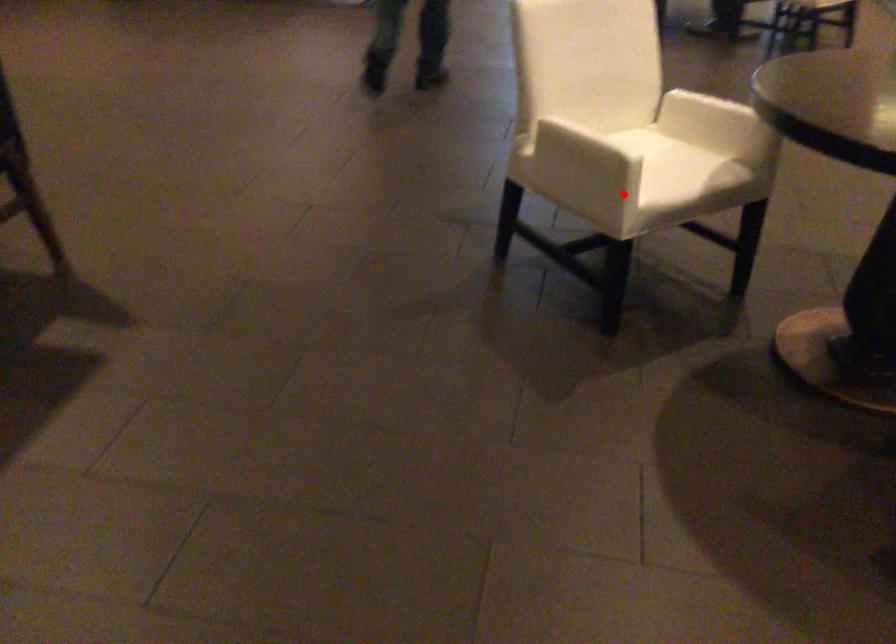
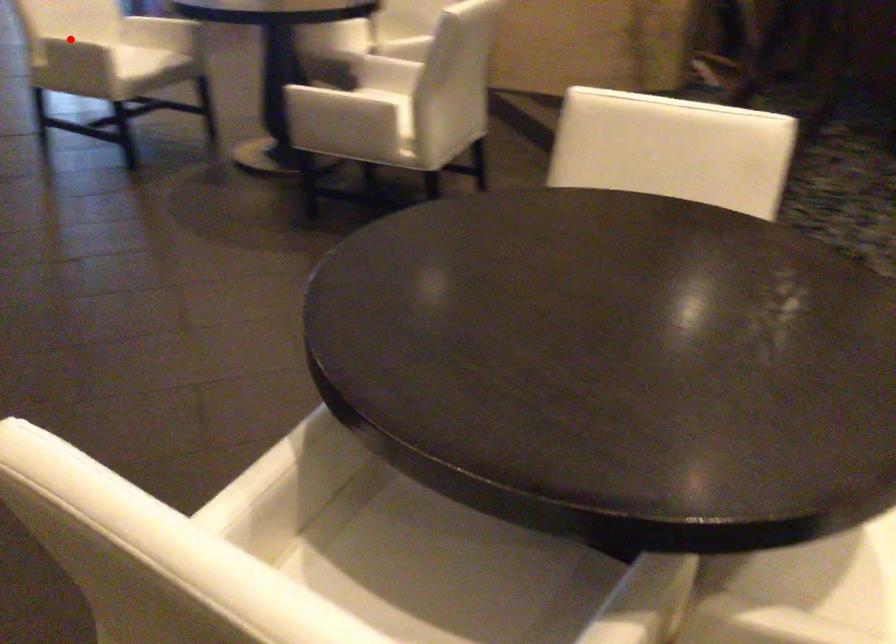
I am providing you with two images of the same scene from different viewpoints. A red point is marked on the first image and another point is marked on the second image. Does the point marked in image1 correspond to the same location as the one in image2?

Yes